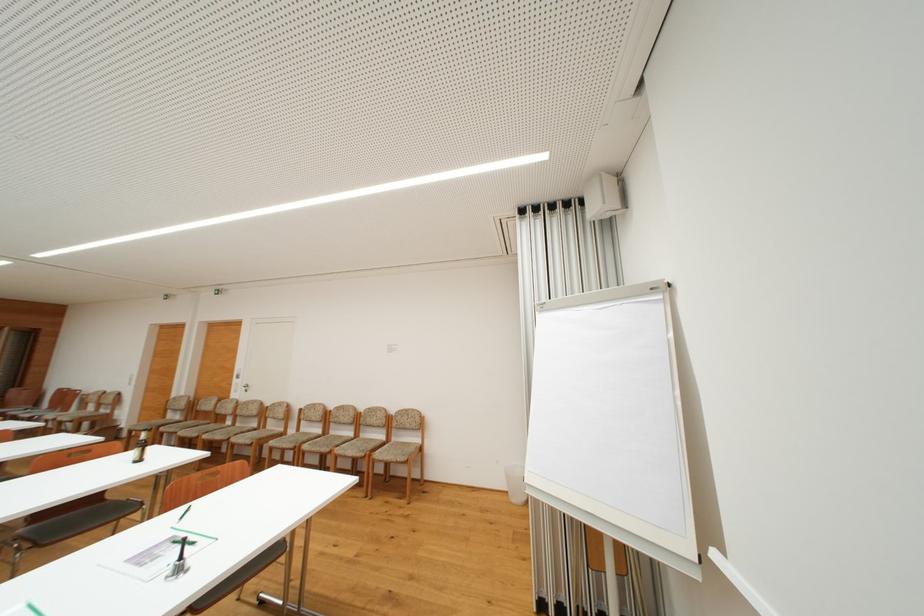
What do you see at coordinates (245, 387) in the screenshot? The width and height of the screenshot is (924, 616). I see `a metal door handle` at bounding box center [245, 387].